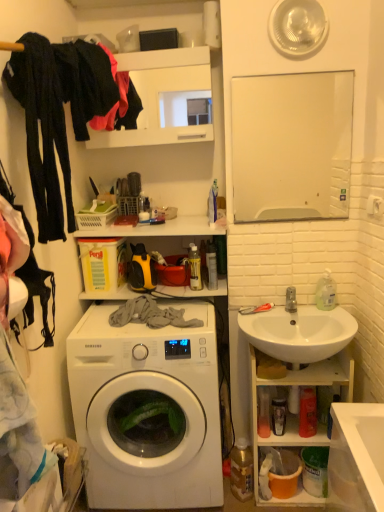
This screenshot has height=512, width=384. Describe the element at coordinates (298, 416) in the screenshot. I see `white glossy sink at lower right` at that location.

Image resolution: width=384 pixels, height=512 pixels. What do you see at coordinates (291, 300) in the screenshot? I see `silver metallic faucet at sink right` at bounding box center [291, 300].

Image resolution: width=384 pixels, height=512 pixels. Identify the location of white ceramic sink at right. (299, 333).

Measure the distance between point (326, 74) and camera.

The depth of point (326, 74) is 5.85 feet.

Identify the location of white glossy mirror at upper center. Image resolution: width=384 pixels, height=512 pixels. (291, 146).

Image resolution: width=384 pixels, height=512 pixels. Find the location of `white glossy sink at lower right`. white glossy sink at lower right is located at coordinates (298, 416).

Between point (39, 106) and point (321, 316), which one is positioned in front?

Point (39, 106)

Is white ceramic sink at right at the back of black cotton pants at left, marked as the first clothing in a front-to-back arrangement?

No, white ceramic sink at right is not at the back of black cotton pants at left, marked as the first clothing in a front-to-back arrangement.

Can you tell me how much black cotton pants at left, marked as the first clothing in a front-to-back arrangement, and white ceramic sink at right differ in facing direction?

The facing directions of black cotton pants at left, marked as the first clothing in a front-to-back arrangement, and white ceramic sink at right are 88.6 degrees apart.

Locate an element on the screen. The height and width of the screenshot is (512, 384). clothing that is the 1st one when counting upward from the white ceramic sink at right (from the image's perspective) is located at coordinates (43, 132).

Looking at this image, who is smaller, white ceramic sink at right or silver metallic faucet at sink right?

Smaller between the two is silver metallic faucet at sink right.

Does white ceramic sink at right have a lesser width compared to silver metallic faucet at sink right?

No.

Is white ceramic sink at right next to silver metallic faucet at sink right?

No, white ceramic sink at right is not with silver metallic faucet at sink right.

Between white ceramic sink at right and silver metallic faucet at sink right, which one appears on the right side from the viewer's perspective?

Positioned to the right is silver metallic faucet at sink right.

From the image's perspective, is white ceramic sink at right above black fabric at upper left, placed as the first clothing when sorted from back to front?

No.

Considering the relative positions of white ceramic sink at right and black fabric at upper left, placed as the first clothing when sorted from back to front, in the image provided, is white ceramic sink at right to the left or to the right of black fabric at upper left, placed as the first clothing when sorted from back to front,?

white ceramic sink at right is positioned on black fabric at upper left, placed as the first clothing when sorted from back to front,'s right side.

Where is `the 2nd clothing directly above the white ceramic sink at right (from a real-world perspective)`? the 2nd clothing directly above the white ceramic sink at right (from a real-world perspective) is located at coordinates (85, 82).

Could you tell me if black cotton pants at left, placed as the second clothing when sorted from back to front, is facing white glossy sink at lower right?

No, black cotton pants at left, placed as the second clothing when sorted from back to front, is not turned towards white glossy sink at lower right.

Can white glossy sink at lower right be found inside black cotton pants at left, marked as the first clothing in a front-to-back arrangement?

Actually, white glossy sink at lower right is outside black cotton pants at left, marked as the first clothing in a front-to-back arrangement.

Between point (55, 225) and point (338, 362), which one is positioned in front?

The point (55, 225) is closer.

Looking at this image, how far apart are silver metallic faucet at sink right and white ceramic sink at right?

The distance of silver metallic faucet at sink right from white ceramic sink at right is 7.59 inches.

Does silver metallic faucet at sink right have a lesser height compared to white ceramic sink at right?

Correct, silver metallic faucet at sink right is not as tall as white ceramic sink at right.

Which object is positioned more to the right, silver metallic faucet at sink right or white ceramic sink at right?

Positioned to the right is silver metallic faucet at sink right.

Between silver metallic faucet at sink right and white ceramic sink at right, which one has larger width?

With larger width is white ceramic sink at right.

Is black fabric at upper left, marked as the 2th clothing in a front-to-back arrangement, positioned before white glossy washing machine at center?

Yes, black fabric at upper left, marked as the 2th clothing in a front-to-back arrangement, is in front of white glossy washing machine at center.

Is black fabric at upper left, marked as the 2th clothing in a front-to-back arrangement, taller or shorter than white glossy washing machine at center?

In the image, black fabric at upper left, marked as the 2th clothing in a front-to-back arrangement, appears to be shorter than white glossy washing machine at center.

Can we say black fabric at upper left, placed as the first clothing when sorted from back to front, lies outside white glossy washing machine at center?

That's correct, black fabric at upper left, placed as the first clothing when sorted from back to front, is outside of white glossy washing machine at center.

From the image's perspective, starting from the white glossy washing machine at center, which clothing is the 2nd one above? Please provide its 2D coordinates.

[(85, 82)]

Which of these two, white glossy mirror at upper center or black cotton pants at left, marked as the first clothing in a front-to-back arrangement, stands shorter?

Standing shorter between the two is white glossy mirror at upper center.

Is white glossy mirror at upper center in front of black cotton pants at left, placed as the second clothing when sorted from back to front?

No, white glossy mirror at upper center is behind black cotton pants at left, placed as the second clothing when sorted from back to front.

Considering the relative sizes of white glossy mirror at upper center and black cotton pants at left, placed as the second clothing when sorted from back to front, in the image provided, is white glossy mirror at upper center thinner than black cotton pants at left, placed as the second clothing when sorted from back to front,?

Yes.

Based on the photo, is white glossy mirror at upper center bigger than black cotton pants at left, marked as the first clothing in a front-to-back arrangement?

No.

You are a GUI agent. You are given a task and a screenshot of the screen. Output one action in this format:
    pyautogui.click(x=<x>, y=<y>)
    Task: Click on the 1st clothing above the white ceramic sink at right (from the image's perspective)
    Image resolution: width=384 pixels, height=512 pixels.
    Given the screenshot: What is the action you would take?
    pyautogui.click(x=43, y=132)

Where is `sink beneath the silver metallic faucet at sink right (from a real-world perspective)`? sink beneath the silver metallic faucet at sink right (from a real-world perspective) is located at coordinates (299, 333).

Based on their spatial positions, is white glossy sink at lower right or black cotton pants at left, placed as the second clothing when sorted from back to front, closer to white ceramic sink at right?

white glossy sink at lower right lies closer to white ceramic sink at right than the other object.

Estimate the real-world distances between objects in this image. Which object is closer to black fabric at upper left, placed as the first clothing when sorted from back to front, clear plastic bottle at right or silver metallic faucet at sink right?

silver metallic faucet at sink right lies closer to black fabric at upper left, placed as the first clothing when sorted from back to front, than the other object.

Estimate the real-world distances between objects in this image. Which object is further from clear plastic bottle at right, black fabric at upper left, placed as the first clothing when sorted from back to front, or silver metallic faucet at sink right?

Based on the image, black fabric at upper left, placed as the first clothing when sorted from back to front, appears to be further to clear plastic bottle at right.

When comparing their distances from white glossy sink at lower right, does white ceramic sink at right or white glossy mirror at upper center seem closer?

Among the two, white ceramic sink at right is located nearer to white glossy sink at lower right.

Estimate the real-world distances between objects in this image. Which object is further from black cotton pants at left, placed as the second clothing when sorted from back to front, clear plastic bottle at right or white ceramic sink at right?

Based on the image, clear plastic bottle at right appears to be further to black cotton pants at left, placed as the second clothing when sorted from back to front.

Based on their spatial positions, is white ceramic sink at right or silver metallic faucet at sink right closer to clear plastic bottle at right?

silver metallic faucet at sink right is closer to clear plastic bottle at right.

Based on their spatial positions, is black fabric at upper left, marked as the 2th clothing in a front-to-back arrangement, or silver metallic faucet at sink right further from white glossy mirror at upper center?

black fabric at upper left, marked as the 2th clothing in a front-to-back arrangement, is further to white glossy mirror at upper center.

Considering their positions, is black cotton pants at left, marked as the first clothing in a front-to-back arrangement, positioned further to black fabric at upper left, marked as the 2th clothing in a front-to-back arrangement, than clear plastic bottle at right?

Based on the image, clear plastic bottle at right appears to be further to black fabric at upper left, marked as the 2th clothing in a front-to-back arrangement.

Where is `clothing between black fabric at upper left, placed as the first clothing when sorted from back to front, and white ceramic sink at right vertically`? Image resolution: width=384 pixels, height=512 pixels. clothing between black fabric at upper left, placed as the first clothing when sorted from back to front, and white ceramic sink at right vertically is located at coordinates (43, 132).

What are the coordinates of `sink between black cotton pants at left, placed as the second clothing when sorted from back to front, and white glossy sink at lower right, in the vertical direction` in the screenshot? It's located at (299, 333).

I want to click on sink between silver metallic faucet at sink right and white glossy sink at lower right in the up-down direction, so click(299, 333).

Find the location of a particular element. tap between black fabric at upper left, placed as the first clothing when sorted from back to front, and white glossy sink at lower right from top to bottom is located at coordinates coord(291,300).